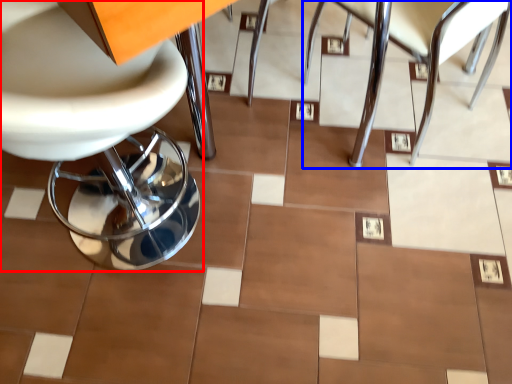
Question: Which object appears farthest to the camera in this image, chair (highlighted by a red box) or chair (highlighted by a blue box)?

Choices:
 (A) chair
 (B) chair

Answer: (B)